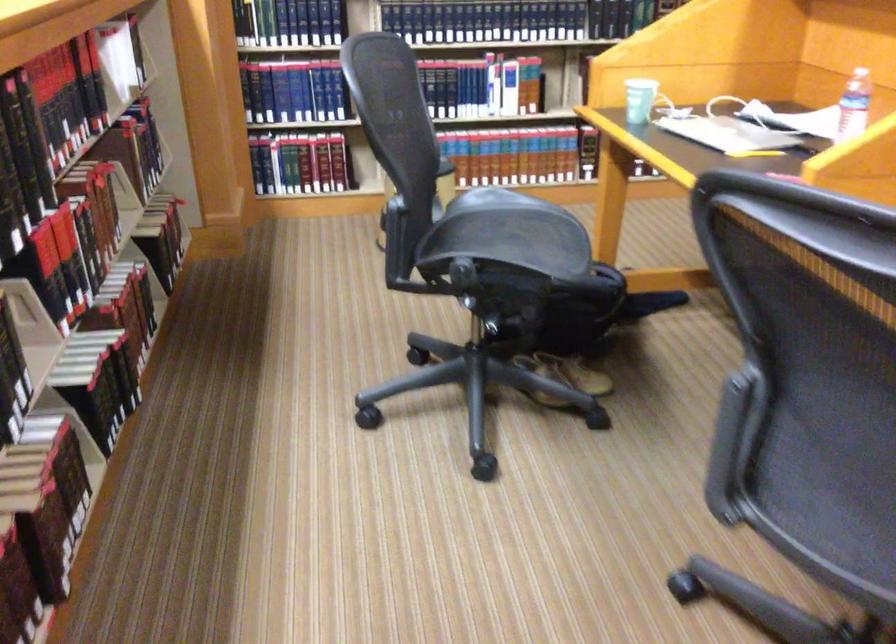
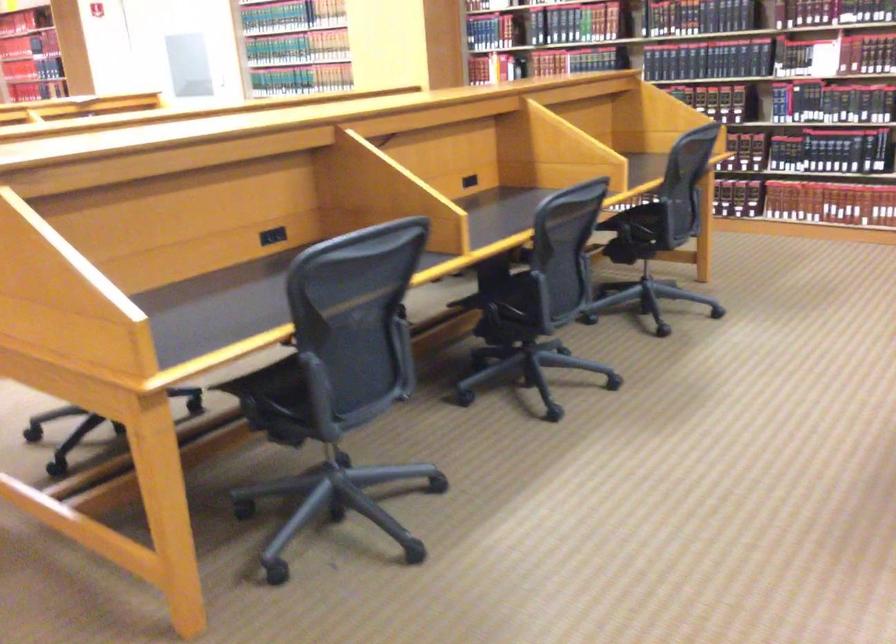
Question: I am providing you with two images of the same scene from different viewpoints. After the viewpoint changes to image2, which objects are now occluded?

Choices:
 (A) yellow balloon
 (B) chair sitting surface
 (C) chair armrest
 (D) plastic water bottle

Answer: (D)